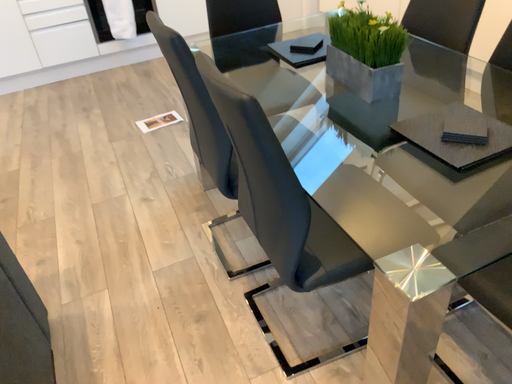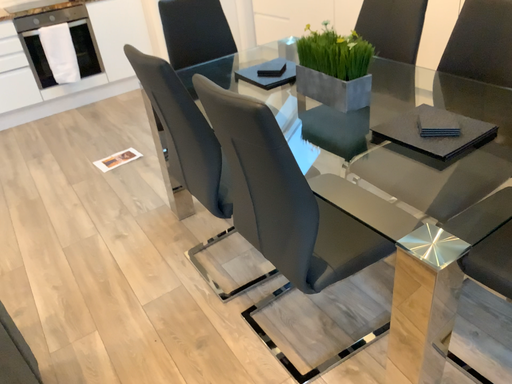
Question: Which way did the camera rotate in the video?

Choices:
 (A) rotated right
 (B) rotated left

Answer: (A)